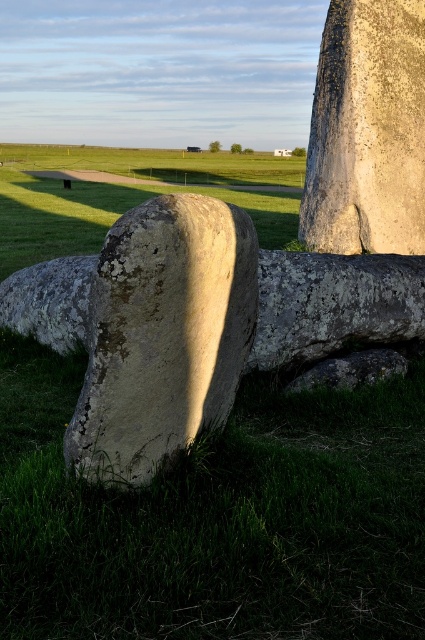
Question: Does rough stone boulder at center appear under speckled stone boulder at center?

Choices:
 (A) no
 (B) yes

Answer: (B)

Question: Is rough stone boulder at center smaller than speckled stone boulder at center?

Choices:
 (A) no
 (B) yes

Answer: (B)

Question: Which point is farther to the camera?

Choices:
 (A) rough stone boulder at center
 (B) speckled stone boulder at center

Answer: (B)

Question: Does rough stone boulder at center come behind speckled stone boulder at center?

Choices:
 (A) no
 (B) yes

Answer: (A)

Question: Which of the following is the farthest from the observer?

Choices:
 (A) (76, 472)
 (B) (414, 28)

Answer: (B)